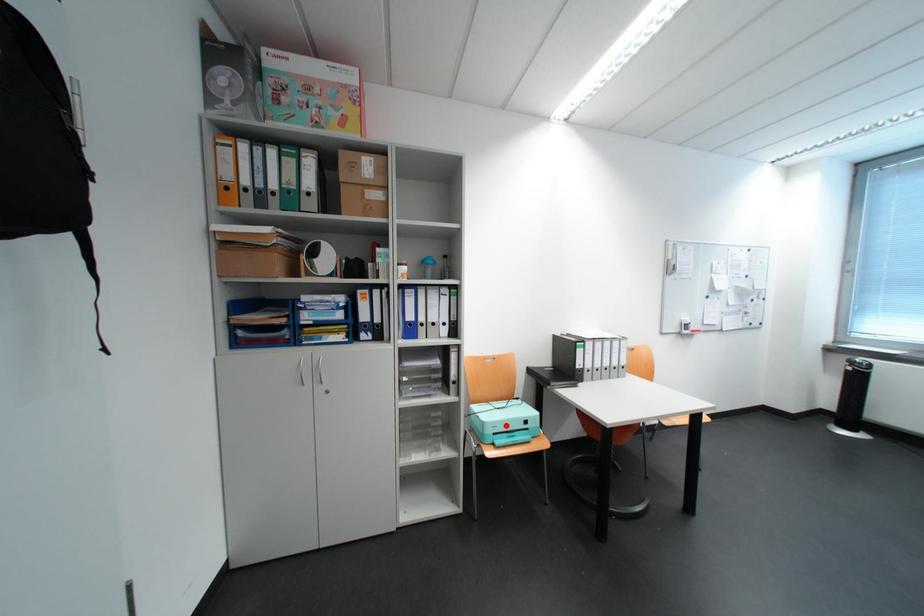
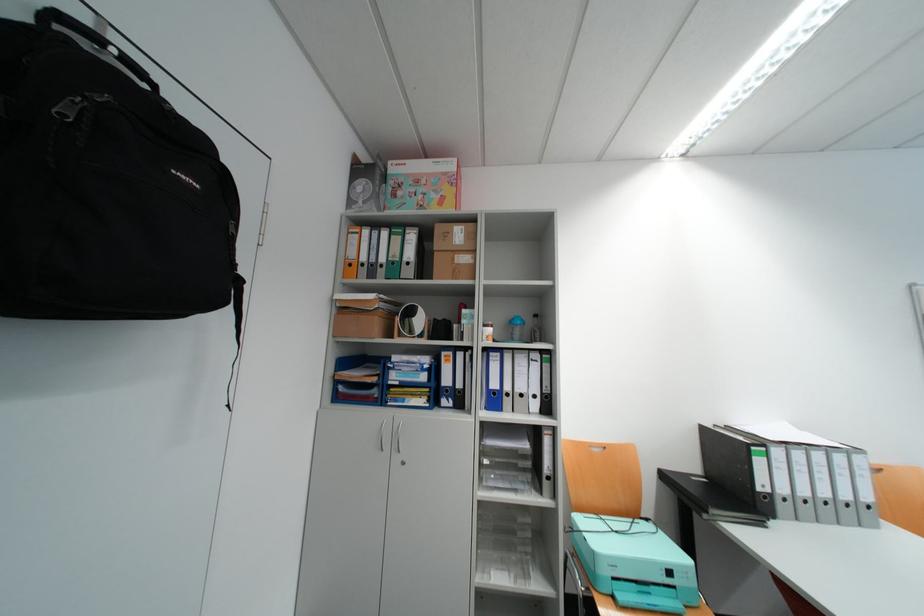
Question: I am providing you with two images of the same scene from different viewpoints. A red point is marked on the first image. At the location where the point appears in image 1, is it still visible in image 2?

Choices:
 (A) Yes
 (B) No

Answer: (A)